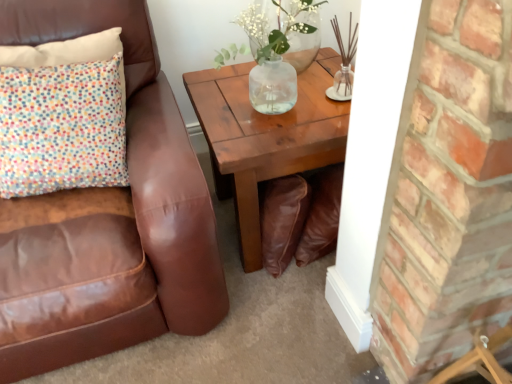
Question: Is clear glass vase at upper center at the back of brown leather chair at left?

Choices:
 (A) yes
 (B) no

Answer: (B)

Question: Is brown leather chair at left thinner than clear glass vase at upper center?

Choices:
 (A) yes
 (B) no

Answer: (B)

Question: Is brown leather chair at left closer to the viewer compared to clear glass vase at upper center?

Choices:
 (A) no
 (B) yes

Answer: (B)

Question: From the image's perspective, is brown leather chair at left under clear glass vase at upper center?

Choices:
 (A) no
 (B) yes

Answer: (B)

Question: Does brown leather chair at left have a greater height compared to clear glass vase at upper center?

Choices:
 (A) no
 (B) yes

Answer: (B)

Question: From a real-world perspective, does brown leather chair at left sit lower than clear glass vase at upper center?

Choices:
 (A) yes
 (B) no

Answer: (A)

Question: Is clear glass vase at upper center thinner than brown leather chair at left?

Choices:
 (A) yes
 (B) no

Answer: (A)

Question: Would you say brown leather chair at left is part of clear glass vase at upper center's contents?

Choices:
 (A) yes
 (B) no

Answer: (B)

Question: Is clear glass vase at upper center oriented away from brown leather chair at left?

Choices:
 (A) yes
 (B) no

Answer: (B)

Question: Could you tell me if clear glass vase at upper center is turned towards brown leather chair at left?

Choices:
 (A) no
 (B) yes

Answer: (A)

Question: Can you see clear glass vase at upper center touching brown leather chair at left?

Choices:
 (A) no
 (B) yes

Answer: (A)

Question: Does clear glass vase at upper center come in front of brown leather chair at left?

Choices:
 (A) no
 (B) yes

Answer: (A)

Question: From a real-world perspective, is wooden coffee table at center located beneath clear glass vase at upper center?

Choices:
 (A) no
 (B) yes

Answer: (B)